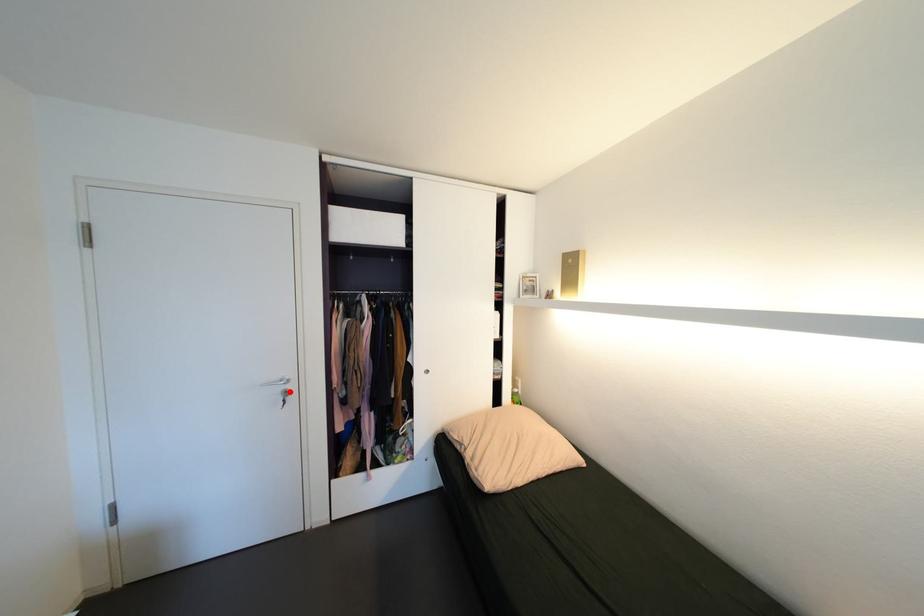
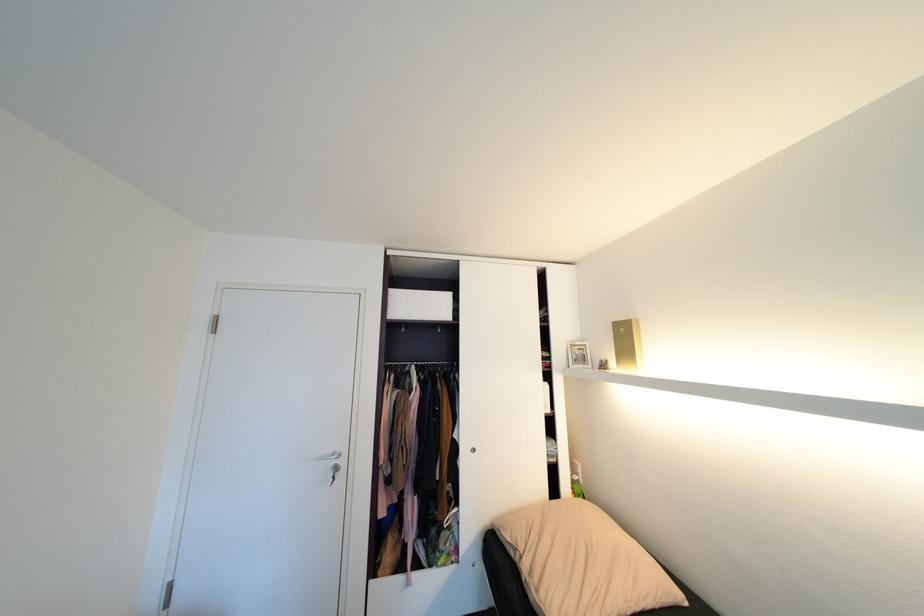
Find the pixel in the second image that matches the highlighted location in the first image.

(341, 467)